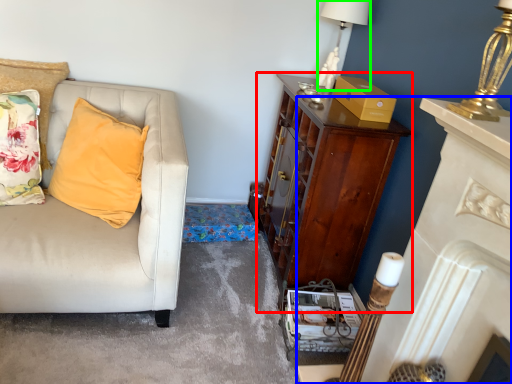
Question: Considering the real-world distances, which object is farthest from cabinetry (highlighted by a red box)? fireplace (highlighted by a blue box) or lamp (highlighted by a green box)?

Choices:
 (A) fireplace
 (B) lamp

Answer: (A)